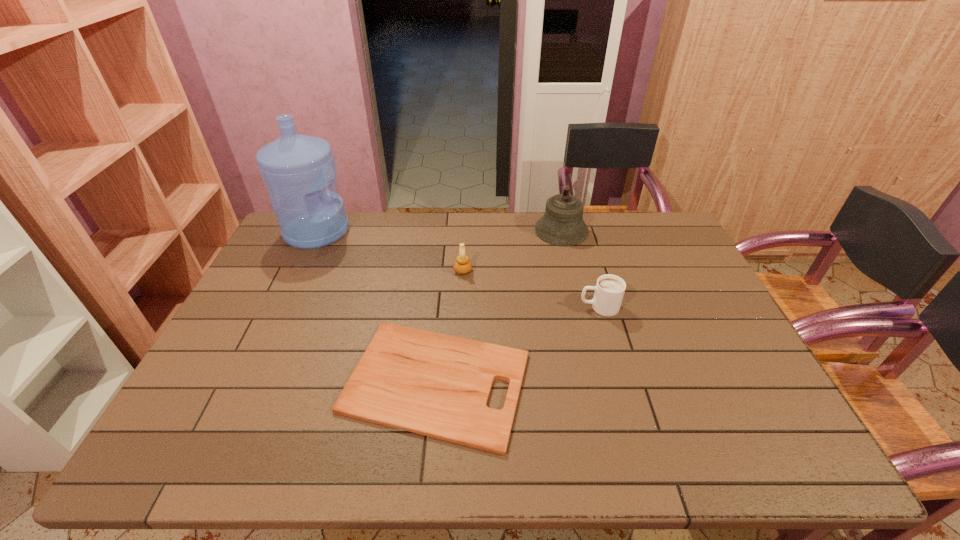
Identify the location of vacant space that is in between the bell and the third shortest object. The image size is (960, 540). (512, 251).

Where is `unoccupied area between the third farthest object and the second tallest object`? The height and width of the screenshot is (540, 960). unoccupied area between the third farthest object and the second tallest object is located at coordinates (512, 251).

This screenshot has height=540, width=960. Find the location of `free area in between the bell and the fourth farthest object`. free area in between the bell and the fourth farthest object is located at coordinates (580, 269).

Locate an element on the screen. The height and width of the screenshot is (540, 960). vacant area that lies between the nearest object and the candle_holder is located at coordinates (449, 326).

Identify the location of the second closest object relative to the water jug. (462, 266).

The height and width of the screenshot is (540, 960). Find the location of `object that is the nearest to the leftmost object`. object that is the nearest to the leftmost object is located at coordinates (437, 385).

What are the coordinates of `vacant space that satisfies the following two spatial constraints: 1. on the side with the handle of the second nearest object; 2. on the front side of the shortest object` in the screenshot? It's located at (620, 382).

What are the coordinates of `vacant space that satisfies the following two spatial constraints: 1. on the back side of the bell; 2. on the left side of the nearest object` in the screenshot? It's located at (450, 230).

Locate an element on the screen. free space that satisfies the following two spatial constraints: 1. on the side of the candle_holder with the handle; 2. on the right side of the leftmost object is located at coordinates (298, 271).

Find the location of a particular element. The height and width of the screenshot is (540, 960). vacant point that satisfies the following two spatial constraints: 1. on the side of the third tallest object with the handle; 2. on the left side of the tallest object is located at coordinates (298, 271).